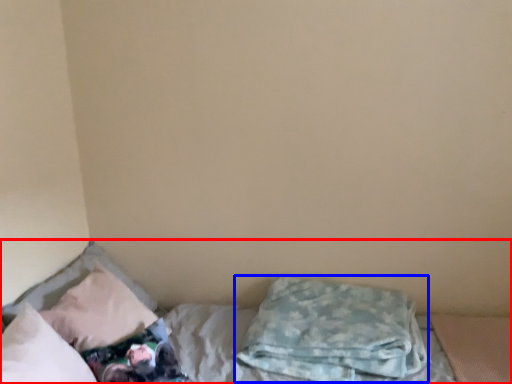
Question: Which point is closer to the camera, bed (highlighted by a red box) or pillow (highlighted by a blue box)?

Choices:
 (A) bed
 (B) pillow

Answer: (A)